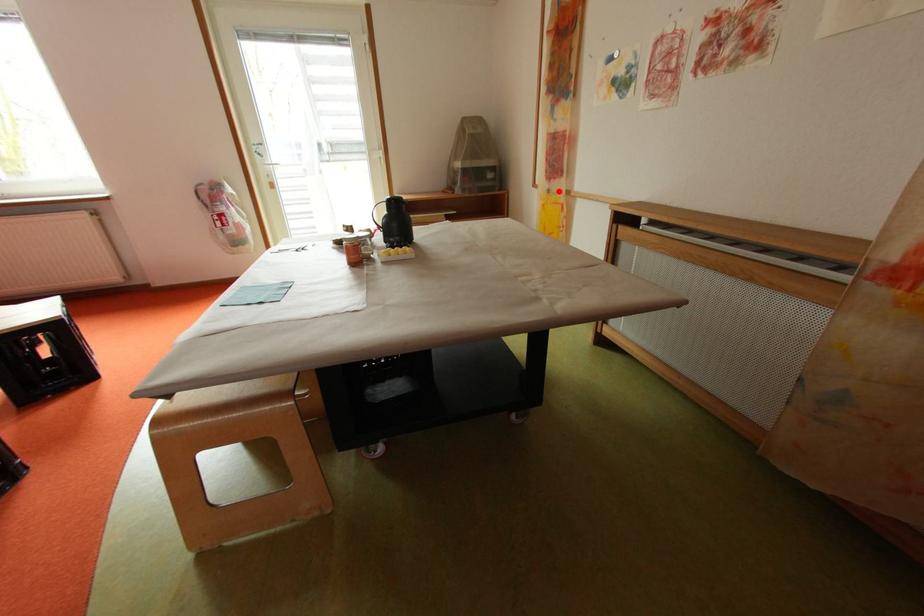
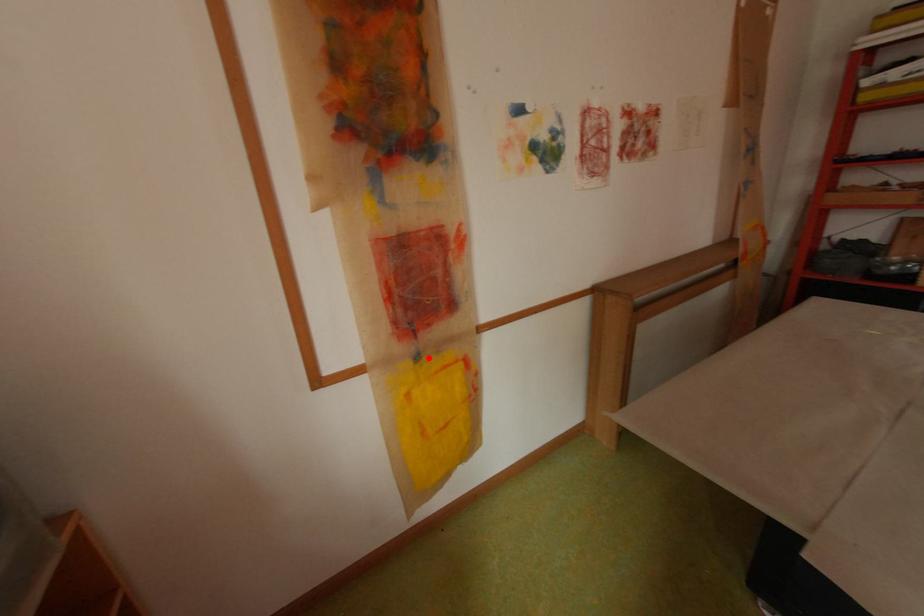
I am providing you with two images of the same scene from different viewpoints. A red point is marked on the first image and another point is marked on the second image. Are the points marked in image1 and image2 representing the same 3D position?

Yes